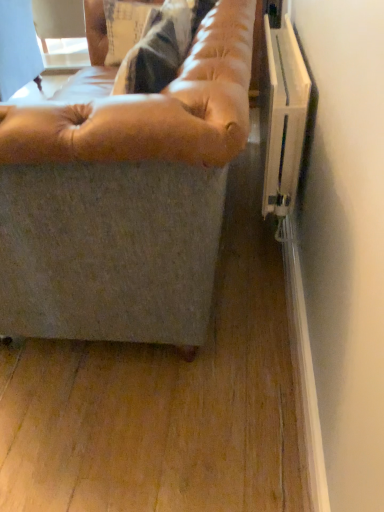
The image size is (384, 512). What do you see at coordinates (153, 108) in the screenshot?
I see `leather-like tan couch at center` at bounding box center [153, 108].

You are a GUI agent. You are given a task and a screenshot of the screen. Output one action in this format:
    pyautogui.click(x=<x>, y=<y>)
    Task: Click on the leather-like tan couch at center
    
    Given the screenshot: What is the action you would take?
    pyautogui.click(x=153, y=108)

The width and height of the screenshot is (384, 512). Describe the element at coordinates (153, 109) in the screenshot. I see `leather-like tan bean bag at center` at that location.

Locate an element on the screen. leather-like tan bean bag at center is located at coordinates 153,109.

The image size is (384, 512). I want to click on leather-like tan couch at center, so click(153, 108).

Would you say leather-like tan bean bag at center is to the left or to the right of leather-like tan couch at center in the picture?

Clearly, leather-like tan bean bag at center is on the right of leather-like tan couch at center in the image.

Considering the relative positions of leather-like tan bean bag at center and leather-like tan couch at center in the image provided, is leather-like tan bean bag at center behind leather-like tan couch at center?

Yes, leather-like tan bean bag at center is further from the camera.

Does point (174, 150) come in front of point (185, 124)?

No, (174, 150) is behind (185, 124).

Consider the image. From the image's perspective, is leather-like tan bean bag at center above leather-like tan couch at center?

No, from the image's perspective, leather-like tan bean bag at center is not over leather-like tan couch at center.

From a real-world perspective, is leather-like tan bean bag at center located higher than leather-like tan couch at center?

Correct, in the physical world, leather-like tan bean bag at center is higher than leather-like tan couch at center.

Which of these two, leather-like tan bean bag at center or leather-like tan couch at center, is wider?

With larger width is leather-like tan couch at center.

Can you confirm if leather-like tan bean bag at center is shorter than leather-like tan couch at center?

Yes, leather-like tan bean bag at center is shorter than leather-like tan couch at center.

Looking at this image, looking at the image, does leather-like tan bean bag at center seem bigger or smaller compared to leather-like tan couch at center?

Clearly, leather-like tan bean bag at center is smaller in size than leather-like tan couch at center.

Is leather-like tan bean bag at center completely or partially outside of leather-like tan couch at center?

No, leather-like tan bean bag at center is not entirely external to leather-like tan couch at center.

Is leather-like tan bean bag at center positioned far away from leather-like tan couch at center?

No.

Is leather-like tan bean bag at center oriented away from leather-like tan couch at center?

Yes, leather-like tan bean bag at center's orientation is away from leather-like tan couch at center.

Where is `bean bag chair located below the leather-like tan couch at center (from the image's perspective)`? This screenshot has width=384, height=512. bean bag chair located below the leather-like tan couch at center (from the image's perspective) is located at coordinates (153, 109).

Considering the positions of objects leather-like tan couch at center and leather-like tan bean bag at center in the image provided, who is more to the left, leather-like tan couch at center or leather-like tan bean bag at center?

leather-like tan couch at center is more to the left.

Which object is further away from the camera taking this photo, leather-like tan couch at center or leather-like tan bean bag at center?

Positioned behind is leather-like tan bean bag at center.

Does point (193, 136) appear closer or farther from the camera than point (223, 123)?

Point (193, 136) is closer to the camera than point (223, 123).

From the image's perspective, between leather-like tan couch at center and leather-like tan bean bag at center, which one is located above?

leather-like tan couch at center.

From a real-world perspective, is leather-like tan couch at center located higher than leather-like tan bean bag at center?

No, from a real-world perspective, leather-like tan couch at center is not on top of leather-like tan bean bag at center.

Considering the relative sizes of leather-like tan couch at center and leather-like tan bean bag at center in the image provided, is leather-like tan couch at center thinner than leather-like tan bean bag at center?

No.

Between leather-like tan couch at center and leather-like tan bean bag at center, which one has less height?

With less height is leather-like tan bean bag at center.

Considering the sizes of objects leather-like tan couch at center and leather-like tan bean bag at center in the image provided, who is smaller, leather-like tan couch at center or leather-like tan bean bag at center?

Smaller between the two is leather-like tan bean bag at center.

Would you say leather-like tan couch at center is outside leather-like tan bean bag at center?

Yes, leather-like tan couch at center is outside of leather-like tan bean bag at center.

Is leather-like tan couch at center not close to leather-like tan bean bag at center?

leather-like tan couch at center is actually quite close to leather-like tan bean bag at center.

Is leather-like tan couch at center facing towards leather-like tan bean bag at center?

No, leather-like tan couch at center is not oriented towards leather-like tan bean bag at center.

Can you tell me how much leather-like tan couch at center and leather-like tan bean bag at center differ in facing direction?

leather-like tan couch at center and leather-like tan bean bag at center are facing 1.27 degrees away from each other.

Measure the distance from leather-like tan couch at center to leather-like tan bean bag at center.

leather-like tan couch at center is 0.95 centimeters away from leather-like tan bean bag at center.

Where is `bean bag chair above the leather-like tan couch at center (from a real-world perspective)`? bean bag chair above the leather-like tan couch at center (from a real-world perspective) is located at coordinates (153, 109).

The height and width of the screenshot is (512, 384). In order to click on studio couch above the leather-like tan bean bag at center (from the image's perspective) in this screenshot , I will do `click(153, 108)`.

The width and height of the screenshot is (384, 512). In order to click on studio couch that is in front of the leather-like tan bean bag at center in this screenshot , I will do `click(153, 108)`.